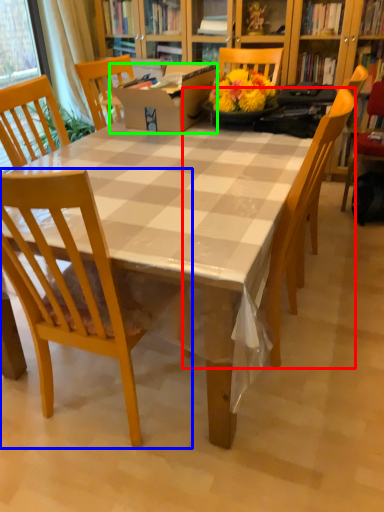
Question: Which object is the farthest from chair (highlighted by a red box)? Choose among these: chair (highlighted by a blue box) or box (highlighted by a green box).

Choices:
 (A) chair
 (B) box

Answer: (B)